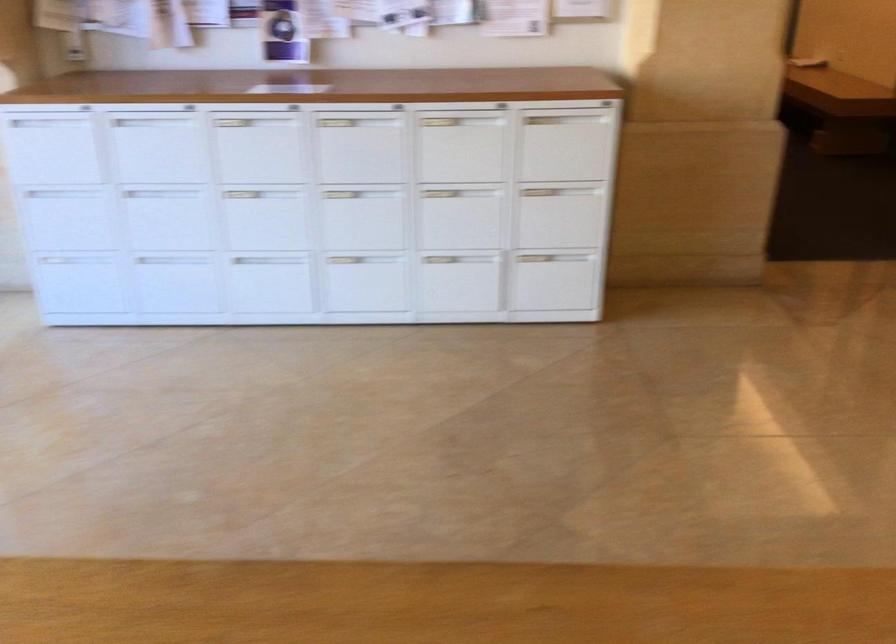
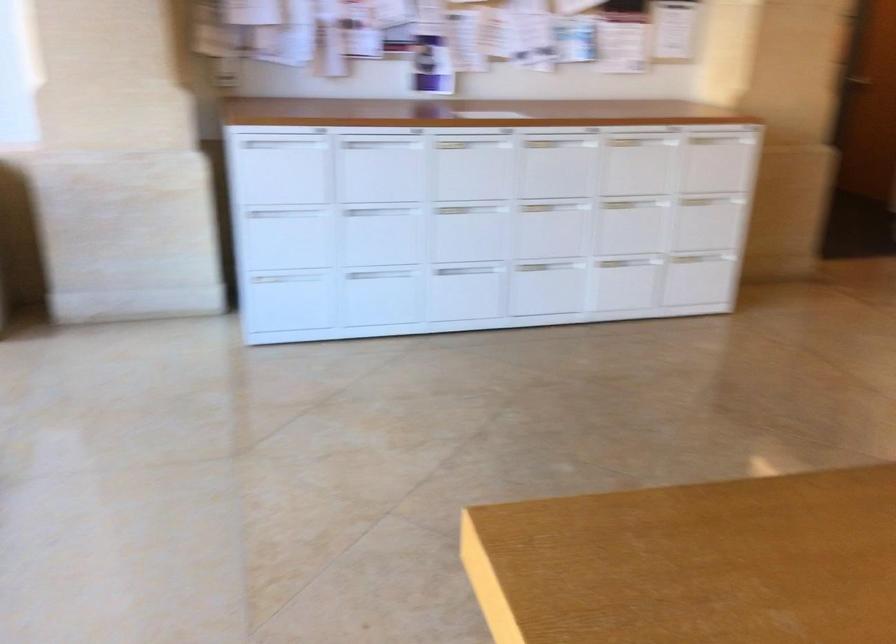
Where in the second image is the point corresponding to point 177,147 from the first image?

(380, 167)